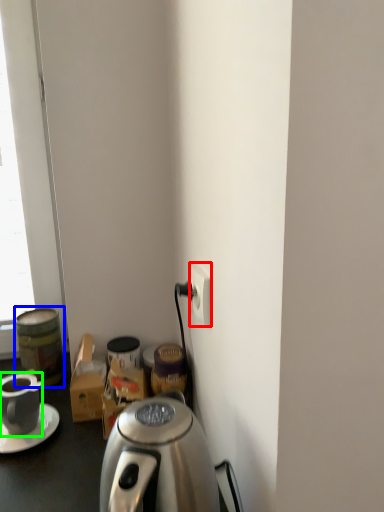
Question: Which object is the farthest from power outlet (highlighted by a red box)? Choose among these: beverage (highlighted by a blue box) or coffee cup (highlighted by a green box).

Choices:
 (A) beverage
 (B) coffee cup

Answer: (A)